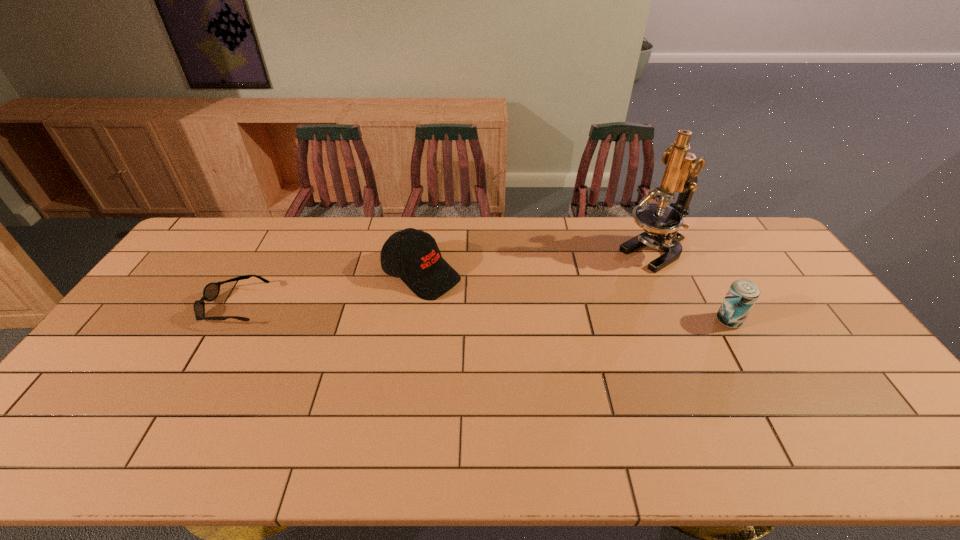
Locate an element on the screen. vacant region located on the front-facing side of the second object from left to right is located at coordinates 467,299.

You are a GUI agent. You are given a task and a screenshot of the screen. Output one action in this format:
    pyautogui.click(x=<x>, y=<y>)
    Task: Click on the free space located at the eyepiece of the microscope
    This screenshot has width=960, height=540.
    Given the screenshot: What is the action you would take?
    pyautogui.click(x=569, y=301)

You are a GUI agent. You are given a task and a screenshot of the screen. Output one action in this format:
    pyautogui.click(x=<x>, y=<y>)
    Task: Click on the vacant space located at the eyepiece of the microscope
    
    Given the screenshot: What is the action you would take?
    pyautogui.click(x=581, y=294)

Identify the location of vacant space located at the eyepiece of the microscope. (569, 301).

Where is `baseball cap situated at the far edge`? Image resolution: width=960 pixels, height=540 pixels. baseball cap situated at the far edge is located at coordinates (425, 272).

The image size is (960, 540). Find the location of `microscope present at the far edge`. microscope present at the far edge is located at coordinates (660, 222).

Find the location of `blank area at the far edge`. blank area at the far edge is located at coordinates (607, 231).

The height and width of the screenshot is (540, 960). In order to click on free location at the near edge in this screenshot , I will do `click(602, 417)`.

Find the location of `vacant space at the left edge of the desktop`. vacant space at the left edge of the desktop is located at coordinates (208, 271).

Where is `free space at the far right corner of the desktop`? free space at the far right corner of the desktop is located at coordinates (742, 217).